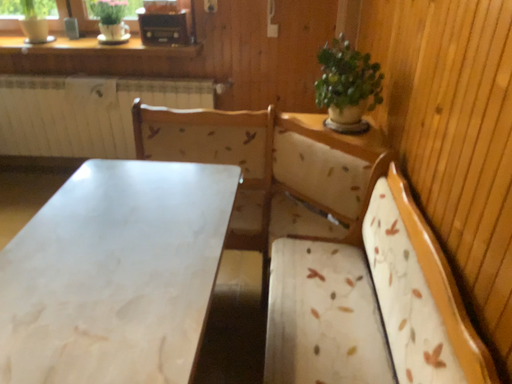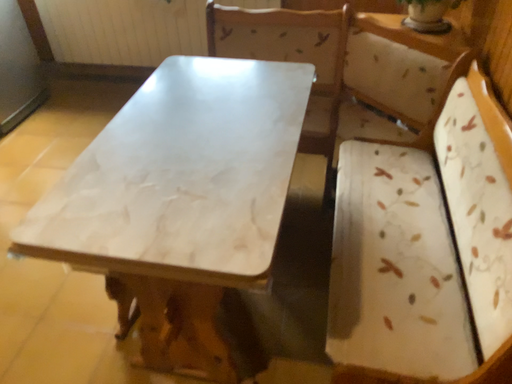
Question: How did the camera likely rotate when shooting the video?

Choices:
 (A) rotated downward
 (B) rotated upward

Answer: (A)